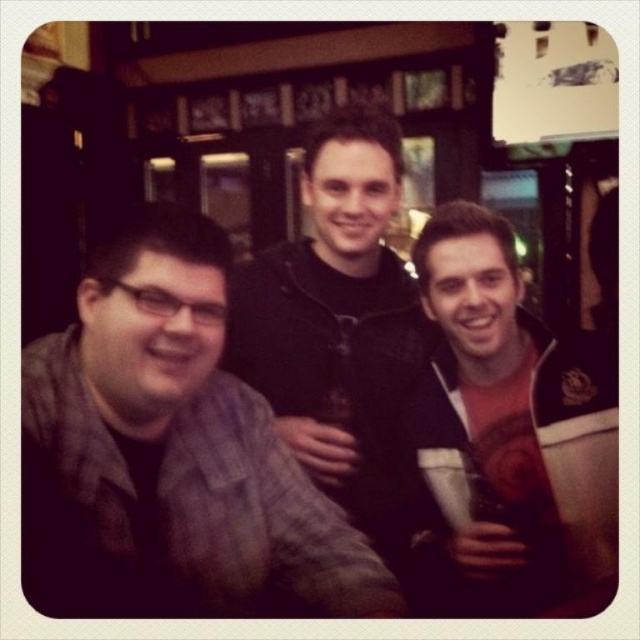
You are holding a 12 inch ruler and want to measure the distance between you and the white matte cup at center. How many rulers would you need to span the distance?

The distance between you and the white matte cup at center is 36.10 inches. Since each ruler is 12 inches long, you would need 3 rulers to span the distance because 36.10 divided by 12 is approximately 3.

You are a photographer setting up a shot of the scene. You want to ensure that the plaid fabric shirt at left and the white matte cup at center are both in focus. Given that your camera can only focus on objects within a 10 cm height range, can you confirm if both objects will be in focus?

The plaid fabric shirt at left has a lesser height compared to white matte cup at center. Since the height difference is not specified, but the camera can focus within a 10 cm range, it depends on their actual heights. However, based on the description alone, we cannot determine if their height difference is within 10 cm. Further measurement is needed.

Looking at this image, you are a photographer setting up a camera to take a group photo of the plaid fabric shirt at left and the black matte jacket at center. The camera has a minimum focus distance of 16 inches. Will you need to adjust your position to ensure both subjects are in focus?

The plaid fabric shirt at left and black matte jacket at center are 17.13 inches apart from each other. Since the minimum focus distance is 16 inches, the camera can capture both subjects in focus without needing to adjust your position.